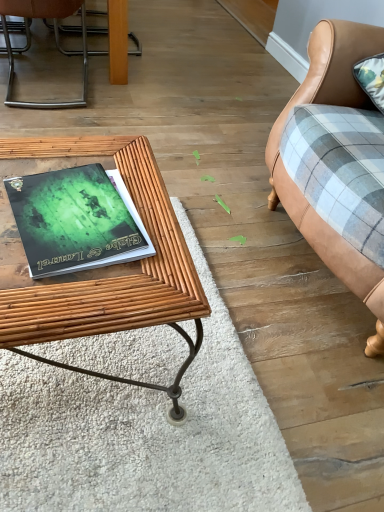
The height and width of the screenshot is (512, 384). What are the coordinates of `vacant region to the left of leather couch at right` in the screenshot? It's located at (215, 206).